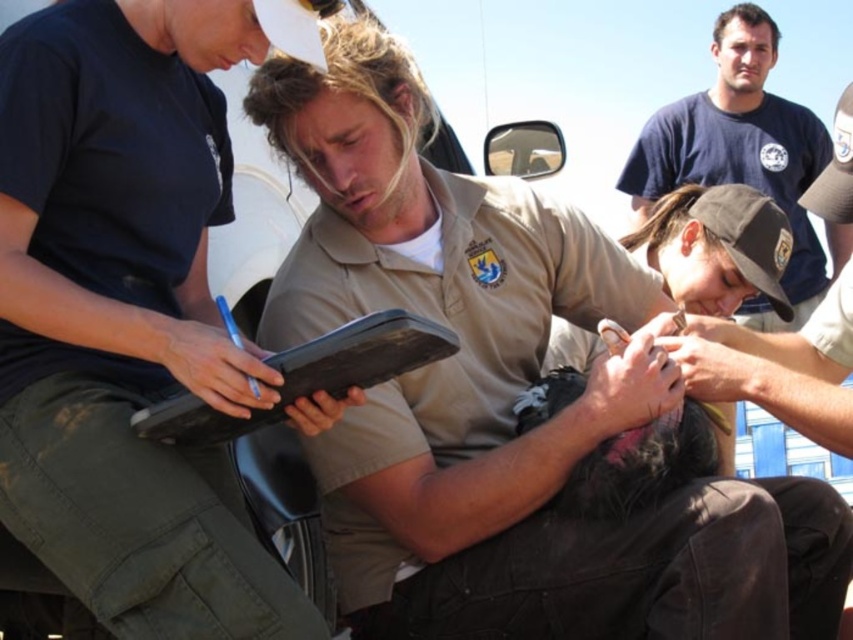
Is matte khaki shirt at center taller than black matte clipboard at center?

Yes.

Can you confirm if matte khaki shirt at center is shorter than black matte clipboard at center?

No.

Is point (57, 451) farther from camera compared to point (277, 416)?

That is False.

The image size is (853, 640). What are the coordinates of `matte khaki shirt at center` in the screenshot? It's located at (126, 317).

Who is taller, matte khaki shirt at center or dark blue t-shirt at upper center?

dark blue t-shirt at upper center is taller.

Is matte khaki shirt at center thinner than dark blue t-shirt at upper center?

Correct, matte khaki shirt at center's width is less than dark blue t-shirt at upper center's.

Image resolution: width=853 pixels, height=640 pixels. I want to click on matte khaki shirt at center, so click(126, 317).

Is dark blue t-shirt at upper center closer to the viewer compared to black matte clipboard at center?

No, dark blue t-shirt at upper center is behind black matte clipboard at center.

Does dark blue t-shirt at upper center appear under black matte clipboard at center?

Incorrect, dark blue t-shirt at upper center is not positioned below black matte clipboard at center.

Who is more forward, [784,324] or [323,381]?

Point [323,381] is in front.

The image size is (853, 640). I want to click on dark blue t-shirt at upper center, so click(740, 150).